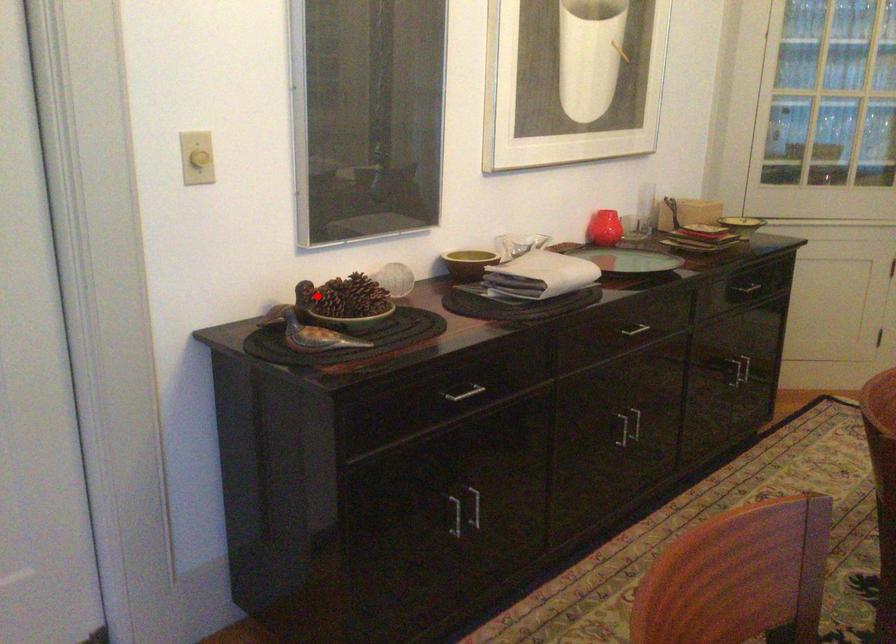
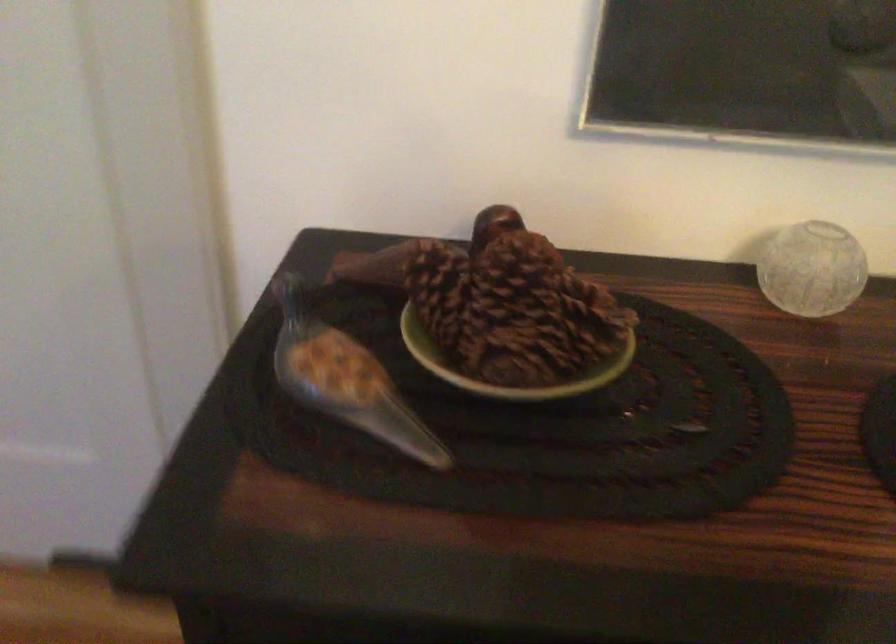
Question: I am providing you with two images of the same scene from different viewpoints. Image1 has a red point marked. In image2, the corresponding 3D location appears at what relative position? Reply with the corresponding letter.

Choices:
 (A) Closer
 (B) Farther

Answer: (A)